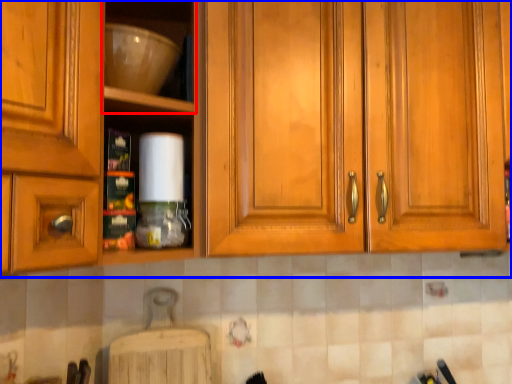
Question: Which point is closer to the camera, shelf (highlighted by a red box) or cabinetry (highlighted by a blue box)?

Choices:
 (A) shelf
 (B) cabinetry

Answer: (A)